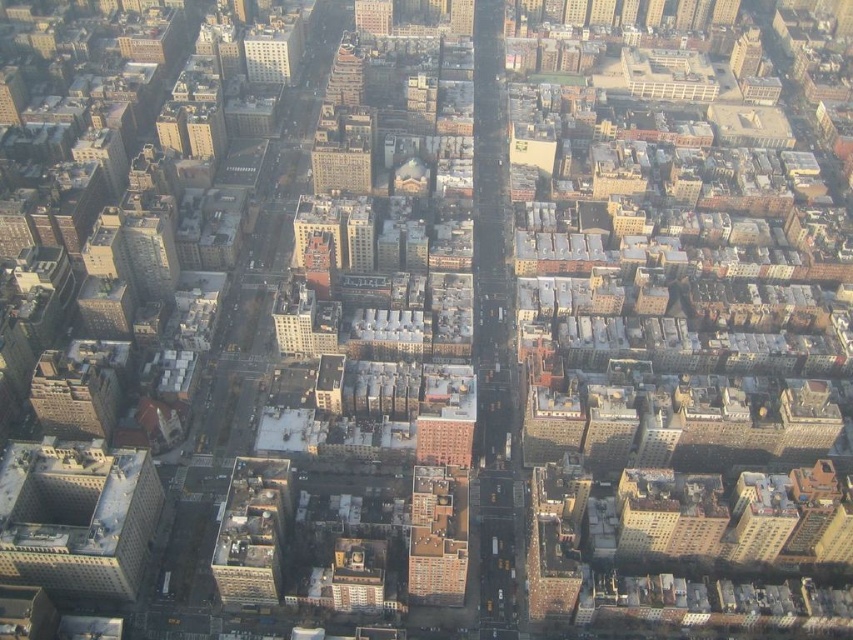
Does gray concrete building at lower left appear over matte gray building at upper center?

No, gray concrete building at lower left is not above matte gray building at upper center.

Which is more to the right, gray concrete building at lower left or matte gray building at upper center?

From the viewer's perspective, matte gray building at upper center appears more on the right side.

Is point (119, 452) positioned in front of point (271, 58)?

Yes.

Locate an element on the screen. gray concrete building at lower left is located at coordinates (77, 516).

Does gray concrete building at lower left lie in front of brown brick building at center?

Yes, gray concrete building at lower left is closer to the viewer.

Who is more forward, (x=96, y=538) or (x=368, y=180)?

Positioned in front is point (x=96, y=538).

This screenshot has height=640, width=853. Identify the location of gray concrete building at lower left. (77, 516).

From the picture: Is matte gray building at center shorter than matte gray building at upper center?

No.

Between point (248, 580) and point (277, 45), which one is positioned behind?

Positioned behind is point (277, 45).

At what (x,y) coordinates should I click in order to perform the action: click on matte gray building at center. Please return your answer as a coordinate pair (x, y). Looking at the image, I should click on [252, 531].